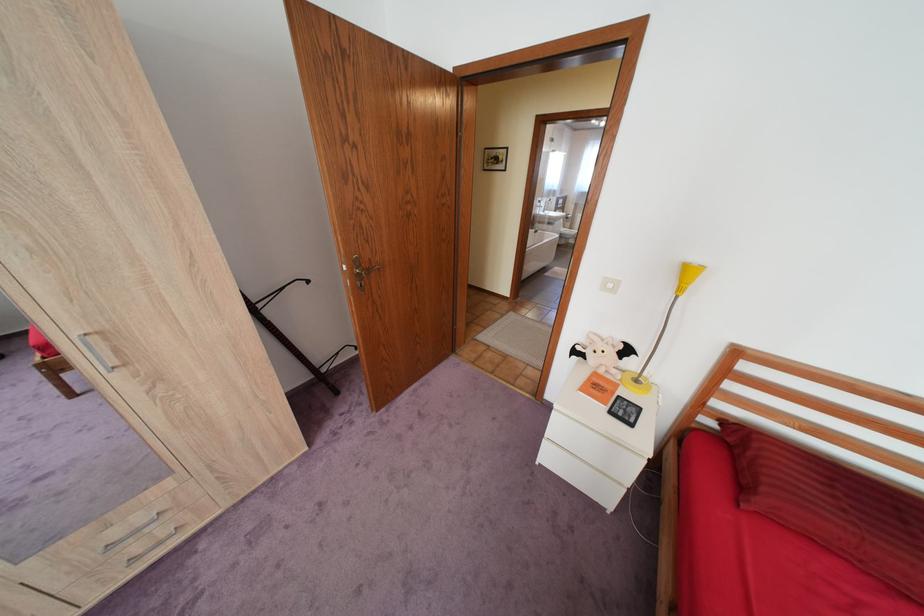
At what (x,y) coordinates should I click in order to perform the action: click on silver cabinet handle. Please return your answer as a coordinate pair (x, y). Looking at the image, I should click on (98, 351).